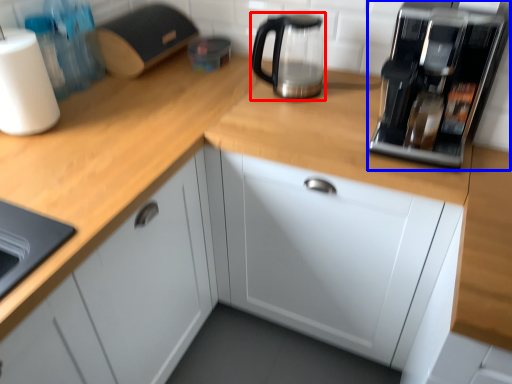
Question: Which object is closer to the camera taking this photo, kitchen appliance (highlighted by a red box) or home appliance (highlighted by a blue box)?

Choices:
 (A) kitchen appliance
 (B) home appliance

Answer: (B)